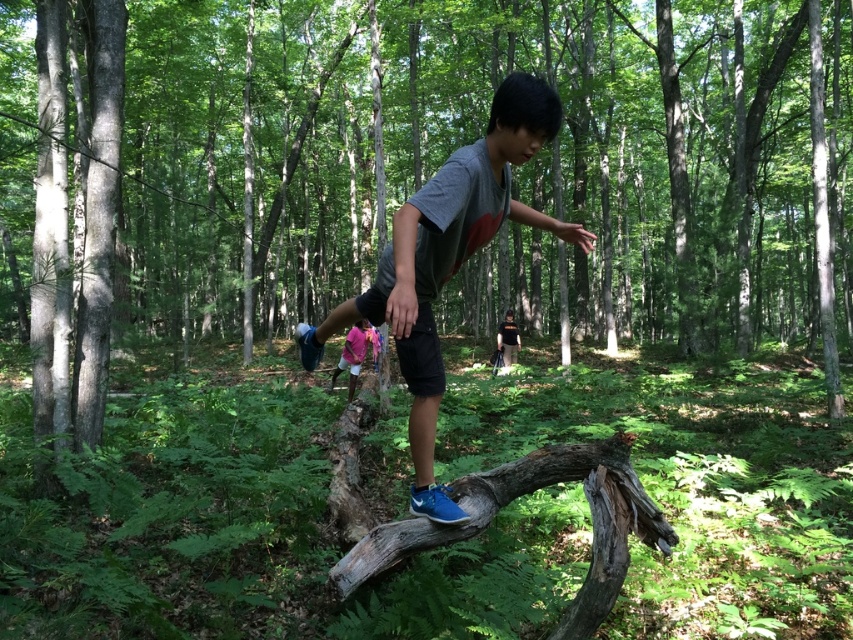
You are standing at the point marked as point [352,380] in the forest scene. You want to walk straight towards the viewer. How far will you have to walk to reach the viewer?

The distance between point [352,380] and the viewer is 29.15 feet, so you will have to walk 29.15 feet to reach the viewer.